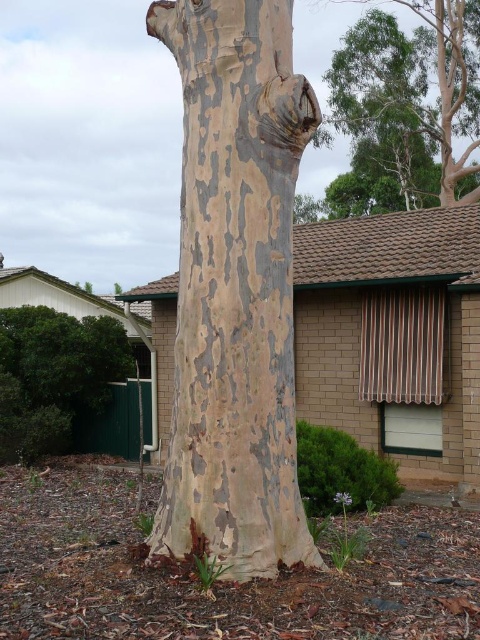
You are standing in front of the tree trunk and want to take a photo of the green leafy bush at lower left without the smooth bark tree at upper right blocking the view. Is this possible?

The green leafy bush at lower left is behind the smooth bark tree at upper right, so you cannot take a photo of the green leafy bush at lower left without the smooth bark tree at upper right blocking the view.

Based on the scene description, which object takes up more area in the image? Please compare the speckled bark tree trunk at center and the green leafy bush at lower left.

The green leafy bush at lower left takes up more area in the image than the speckled bark tree trunk at center according to the description.